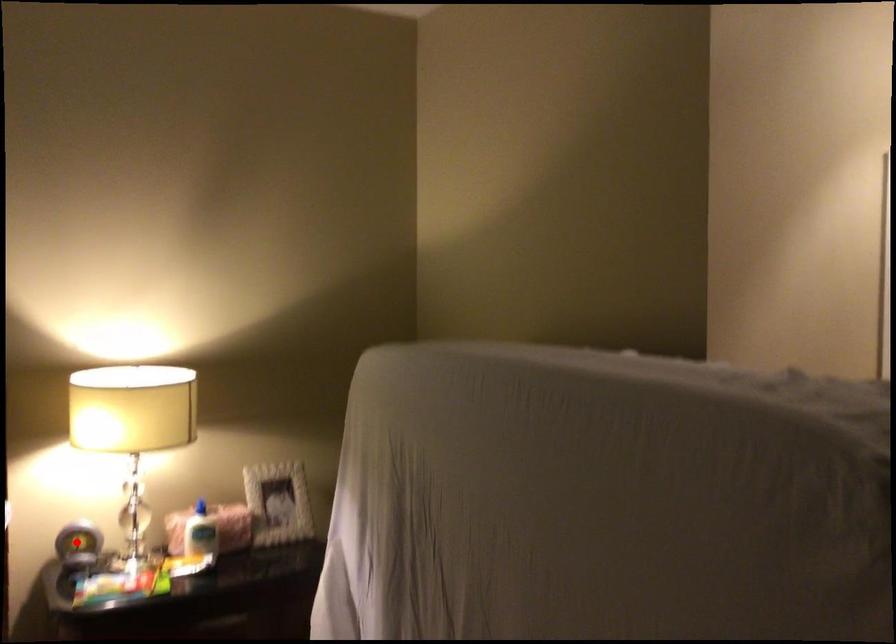
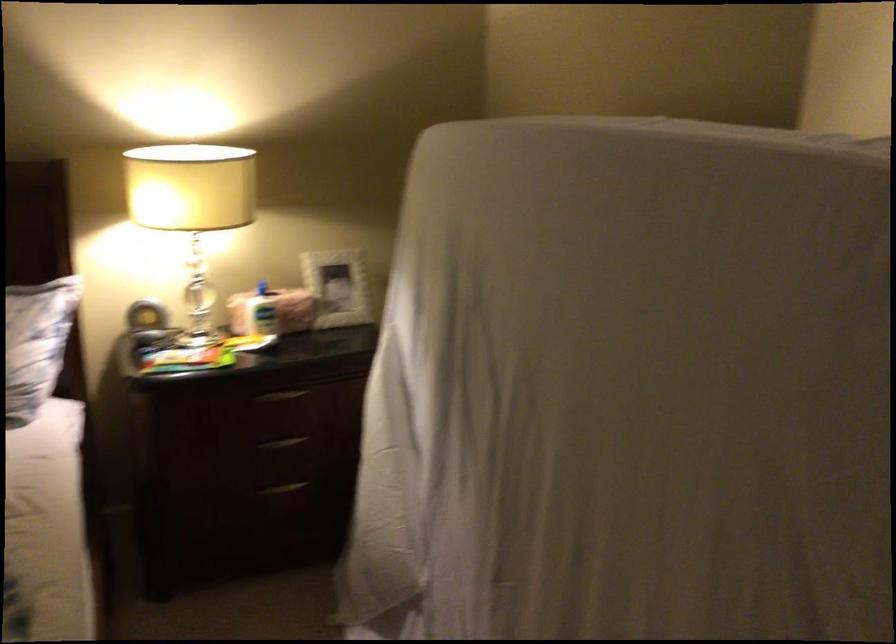
In the second image, find the point that corresponds to the highlighted location in the first image.

(145, 316)